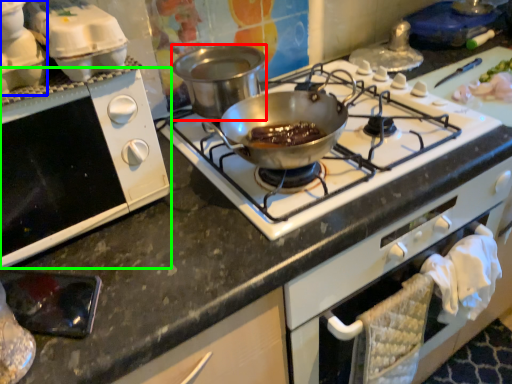
Question: Which object is positioned farthest from pot/pan (highlighted by a red box)? Select from kitchen appliance (highlighted by a blue box) and oven (highlighted by a green box).

Choices:
 (A) kitchen appliance
 (B) oven

Answer: (A)